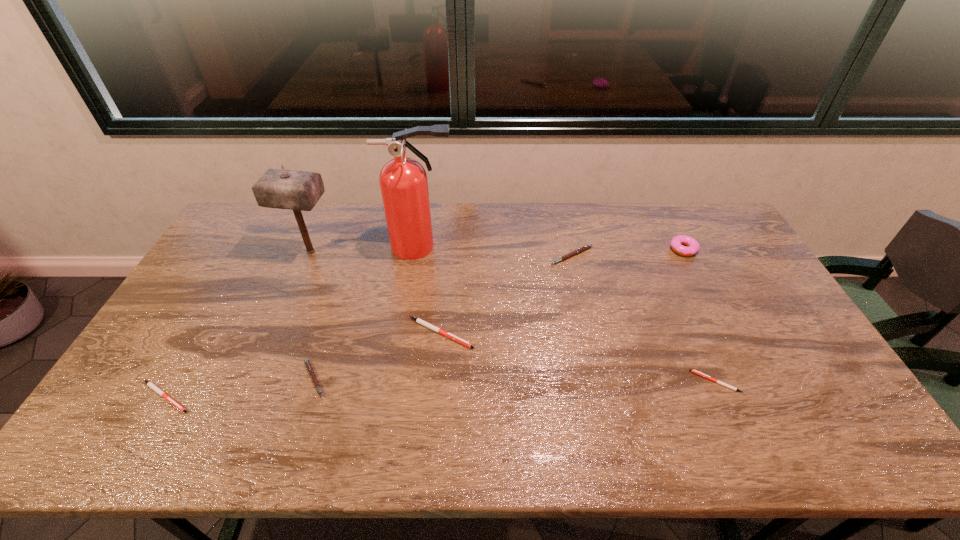
What are the coordinates of `object that is at the far right corner` in the screenshot? It's located at (676, 243).

What are the coordinates of `free space at the far edge of the desktop` in the screenshot? It's located at (557, 239).

Locate an element on the screen. This screenshot has width=960, height=540. vacant space at the near edge is located at coordinates (712, 444).

Image resolution: width=960 pixels, height=540 pixels. In the image, there is a desktop. What are the coordinates of `free space at the left edge` in the screenshot? It's located at (186, 343).

In the image, there is a desktop. At what (x,y) coordinates should I click in order to perform the action: click on vacant space at the far left corner. Please return your answer as a coordinate pair (x, y). This screenshot has width=960, height=540. Looking at the image, I should click on (247, 219).

What are the coordinates of `free space that is in between the fourth pen from right to left and the doughnut` in the screenshot? It's located at (498, 314).

You are a GUI agent. You are given a task and a screenshot of the screen. Output one action in this format:
    pyautogui.click(x=<x>, y=<y>)
    Task: Click on the free spot between the fire extinguisher and the smaller pink pen
    This screenshot has height=540, width=960.
    Given the screenshot: What is the action you would take?
    pyautogui.click(x=368, y=313)

At what (x,y) coordinates should I click in order to perform the action: click on free space between the third pen from right to left and the tallest object. Please return your answer as a coordinate pair (x, y). Image resolution: width=960 pixels, height=540 pixels. Looking at the image, I should click on (430, 290).

At what (x,y) coordinates should I click in order to perform the action: click on empty space between the farthest pen and the seventh shortest object. Please return your answer as a coordinate pair (x, y). The width and height of the screenshot is (960, 540). Looking at the image, I should click on (441, 254).

Find the location of `free space between the rightmost pen and the third tallest object`. free space between the rightmost pen and the third tallest object is located at coordinates (700, 315).